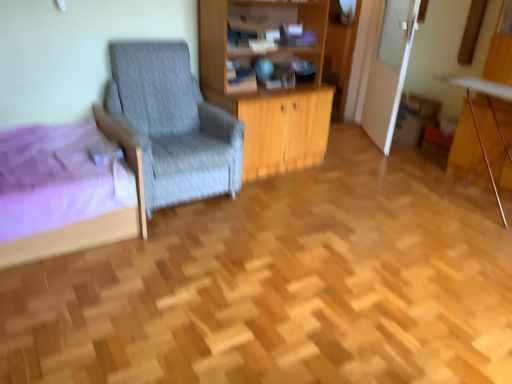
You are a GUI agent. You are given a task and a screenshot of the screen. Output one action in this format:
    pyautogui.click(x=<x>, y=<y>)
    Task: Click on the vacant space to the right of purple fabric bed at lower left
    
    Given the screenshot: What is the action you would take?
    pyautogui.click(x=193, y=245)